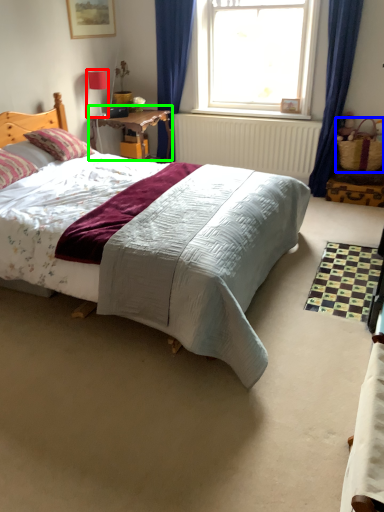
Question: Based on their relative distances, which object is farther from lamp (highlighted by a red box)? Choose from picnic basket (highlighted by a blue box) and table (highlighted by a green box).

Choices:
 (A) picnic basket
 (B) table

Answer: (A)